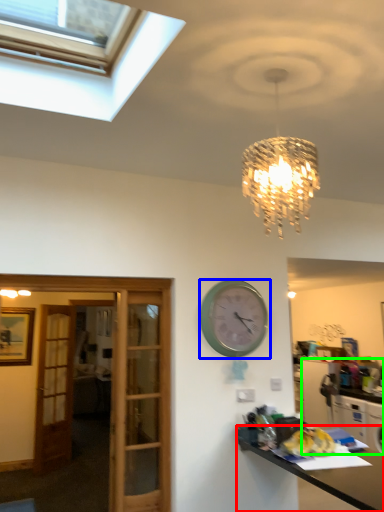
Question: Based on their relative distances, which object is farther from desk (highlighted by a red box)? Choose from wall clock (highlighted by a blue box) and cabinetry (highlighted by a green box).

Choices:
 (A) wall clock
 (B) cabinetry

Answer: (B)